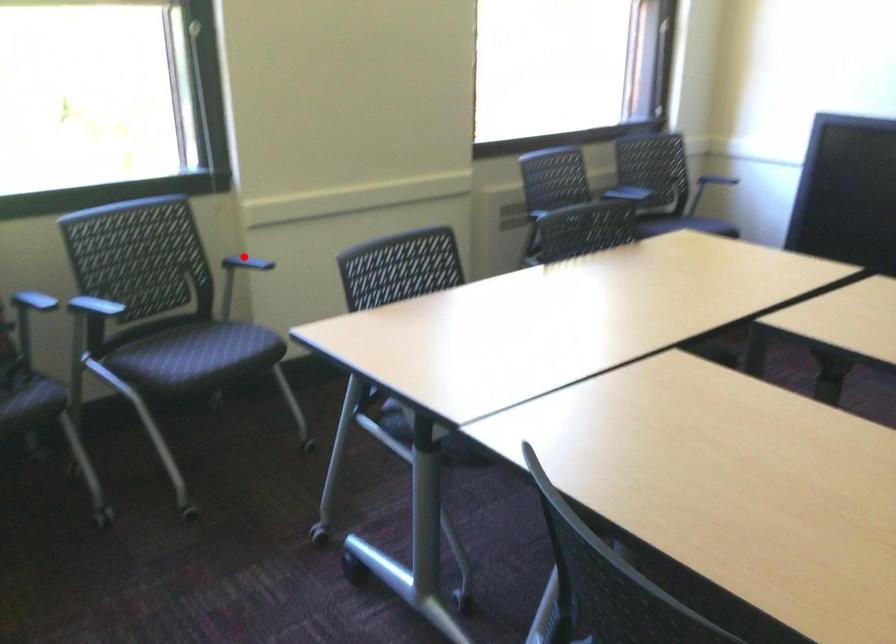
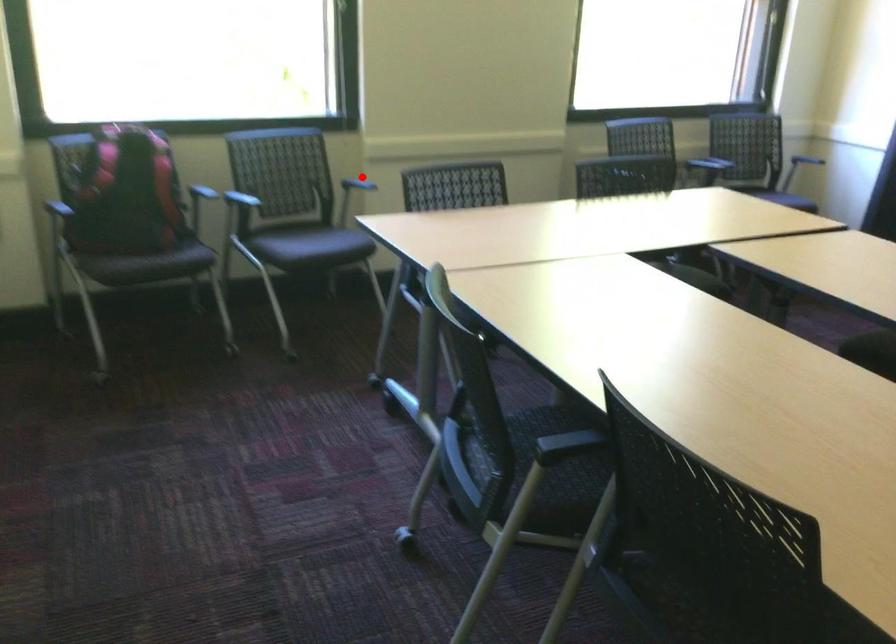
I am providing you with two images of the same scene from different viewpoints. A red point is marked on the first image and another point is marked on the second image. Does the point marked in image1 correspond to the same location as the one in image2?

Yes